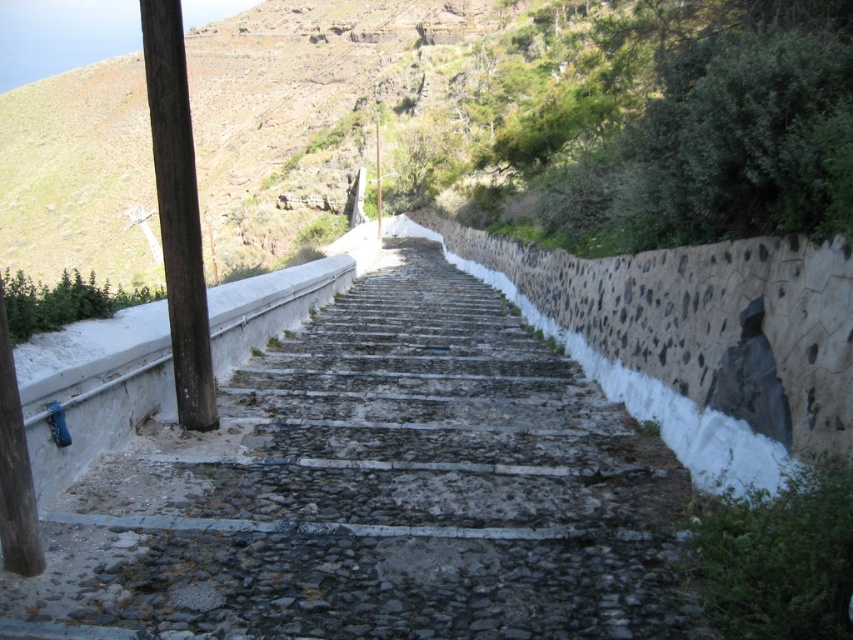
Who is positioned more to the right, rough stone steps at center or brown wood post at left?

rough stone steps at center is more to the right.

Who is positioned more to the left, rough stone steps at center or brown wood post at left?

brown wood post at left is more to the left.

Which is behind, point (660, 468) or point (196, 305)?

The point (196, 305) is more distant.

You are a GUI agent. You are given a task and a screenshot of the screen. Output one action in this format:
    pyautogui.click(x=<x>, y=<y>)
    Task: Click on the rough stone steps at center
    Image resolution: width=853 pixels, height=640 pixels.
    Given the screenshot: What is the action you would take?
    coord(376,492)